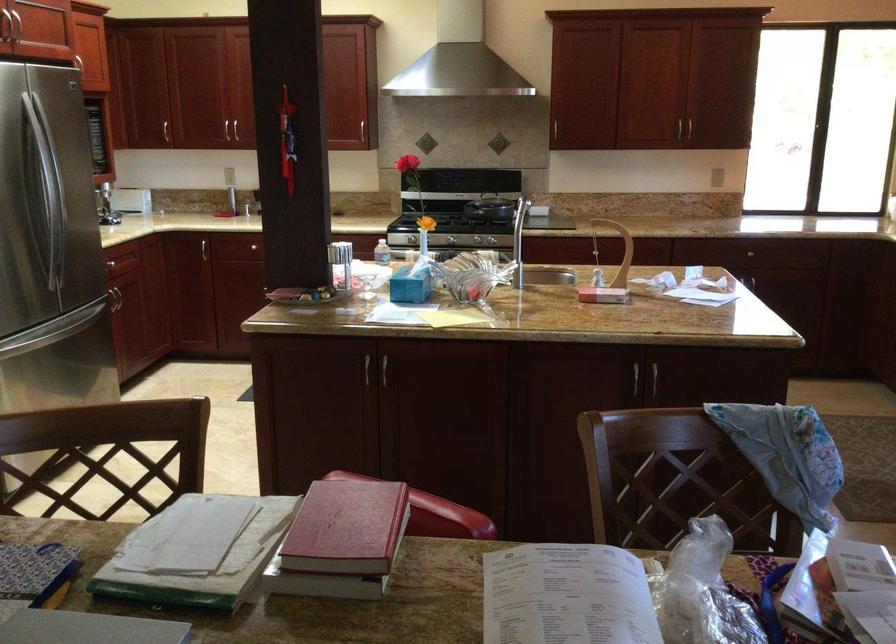
This screenshot has width=896, height=644. What do you see at coordinates (382, 251) in the screenshot? I see `the small plastic bottle` at bounding box center [382, 251].